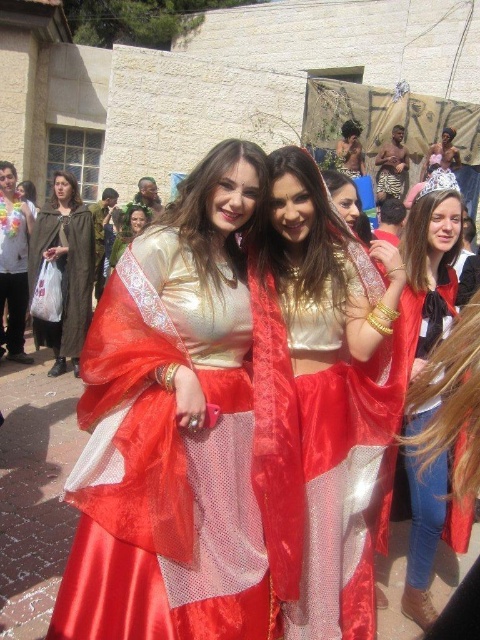
Consider the image. You are a photographer at the event and want to capture both the brown woolen cloak at left and the matte gold dress at center in a single photo. Can you position yourself so that both are fully visible without any obstruction?

The brown woolen cloak at left is in front of the matte gold dress at center, so if you position yourself behind the brown woolen cloak at left, you can capture both without obstruction.

You are standing at the origin point in the image and want to find the satin gold dress at center. According to the coordinates provided, in which direction should you move to locate it?

The satin gold dress at center is located at coordinates point (176, 426), which means it is to the right and slightly above your current position. Move towards the right and upwards to find it.